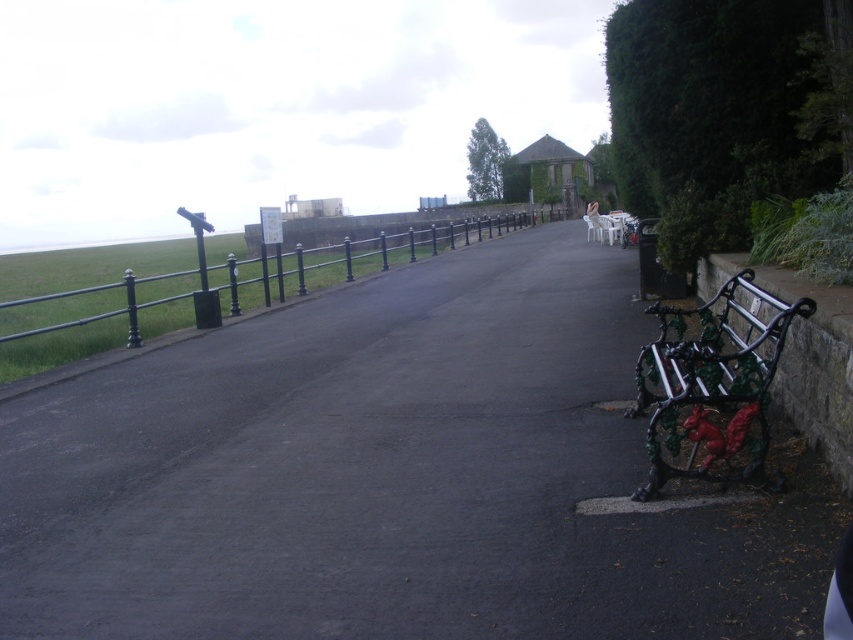
Looking at this image, you are a maintenance worker needing to repair the black asphalt pavement at center. You see the black wrought iron bench at lower right nearby. Can you access the pavement area beneath the bench? Explain why or why not based on their positions.

The black asphalt pavement at center is positioned under the black wrought iron bench at lower right, so yes, the maintenance worker can access the pavement area beneath the bench since the bench is placed above it, allowing access from below.

You are a maintenance worker needing to move a 10 feet long equipment cart from the black wrought iron bench at lower right to the black metal fence at left. Can you move it without turning the cart sideways?

The distance between the black wrought iron bench at lower right and the black metal fence at left is 55.83 feet, which is greater than the cart length of 10 feet, so yes, you can move it without turning the cart sideways.